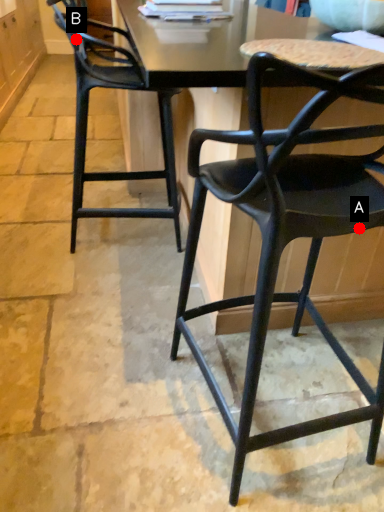
Question: Two points are circled on the image, labeled by A and B beside each circle. Which point is farther to the camera?

Choices:
 (A) A is further
 (B) B is further

Answer: (B)